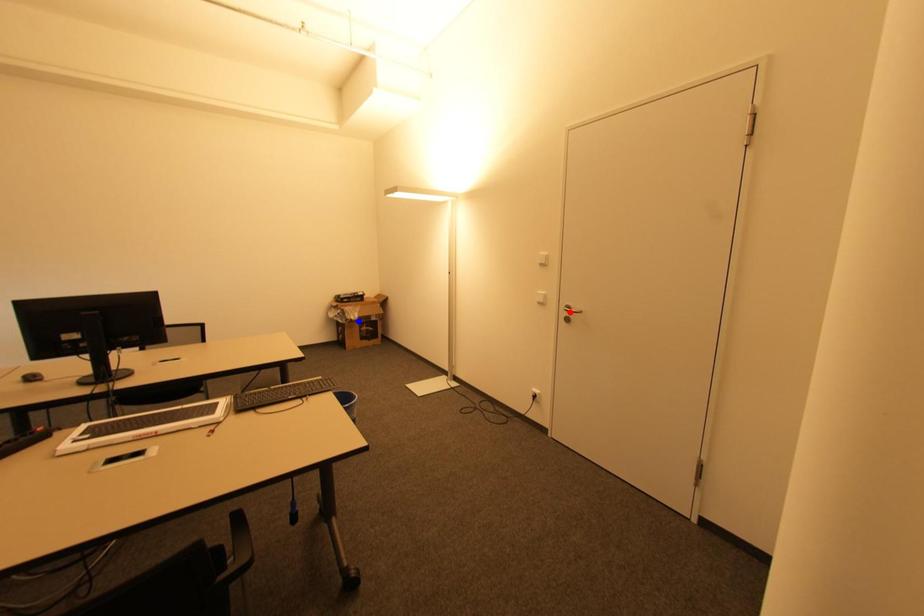
Question: Two points are marked on the image. Which point is closer to the camera?

Choices:
 (A) Blue point is closer.
 (B) Red point is closer.

Answer: (B)